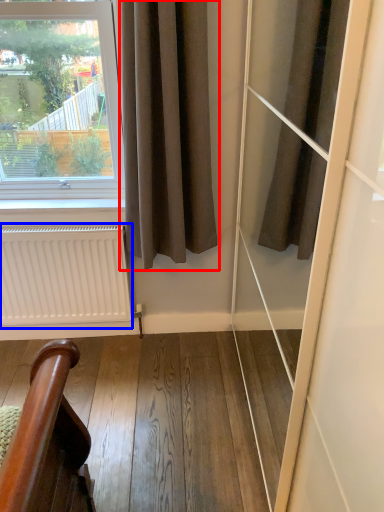
Question: Which of the following is the farthest to the observer, curtain (highlighted by a red box) or radiator (highlighted by a blue box)?

Choices:
 (A) curtain
 (B) radiator

Answer: (B)